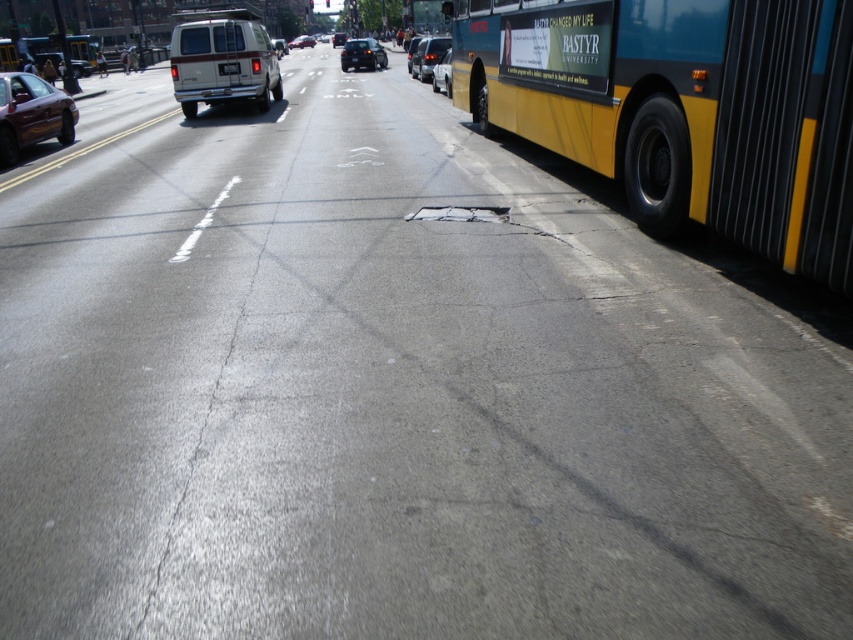
Is point (218, 93) in front of point (12, 81)?

No, it is behind (12, 81).

Identify the location of matte white van at center. (221, 61).

This screenshot has width=853, height=640. Identify the location of matte white van at center. (221, 61).

Can you confirm if teal/yellow metal bus at right is positioned below white plastic license plate at center?

Indeed, teal/yellow metal bus at right is positioned under white plastic license plate at center.

Is point (654, 108) positioned before point (229, 65)?

That is True.

Find the location of `teal/yellow metal bus at right`. teal/yellow metal bus at right is located at coordinates (682, 109).

Does shiny black sedan at center appear over shiny silver van at center?

No, shiny black sedan at center is not above shiny silver van at center.

Does point (350, 49) come closer to viewer compared to point (303, 44)?

That is True.

Identify the location of shiny black sedan at center. This screenshot has height=640, width=853. (363, 54).